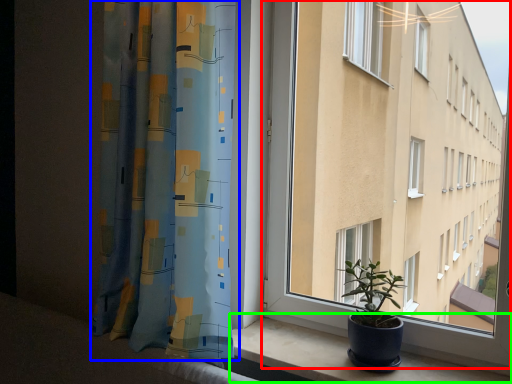
Question: Which is nearer to the window (highlighted by a red box)? curtain (highlighted by a blue box) or window sill (highlighted by a green box).

Choices:
 (A) curtain
 (B) window sill

Answer: (B)